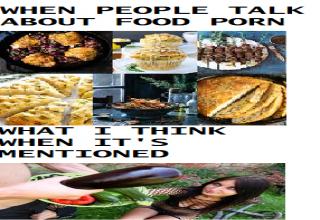
This screenshot has height=220, width=320. What are the coordinates of `plate` in the screenshot? It's located at (228, 67), (278, 78), (188, 69), (190, 49), (6, 55), (1, 122), (146, 112).